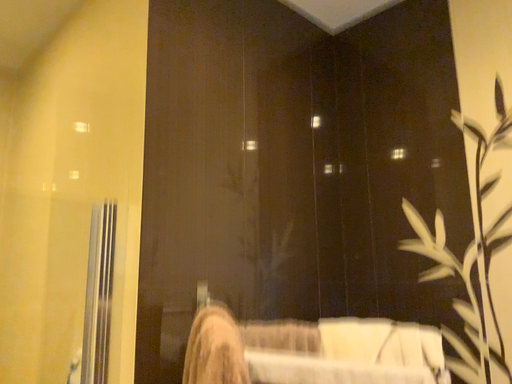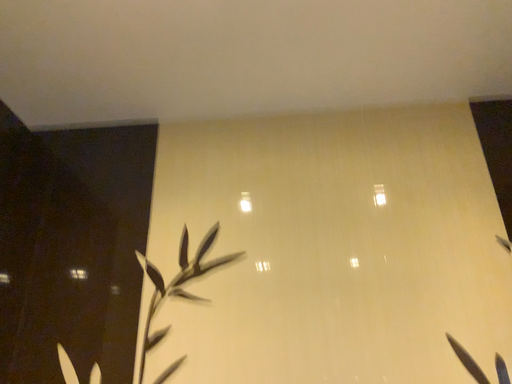
Question: How did the camera likely rotate when shooting the video?

Choices:
 (A) rotated upward
 (B) rotated downward

Answer: (A)